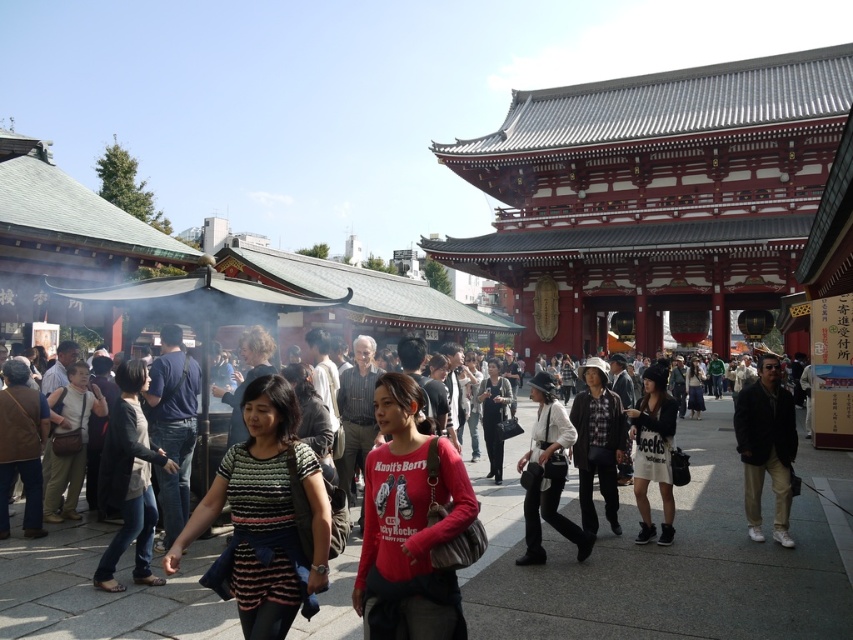
Question: Which of the following is the closest to the observer?

Choices:
 (A) matte red shirt at center
 (B) white cotton dress at center
 (C) dark gray fabric jacket at center

Answer: (A)

Question: Can you confirm if white matte jacket at center is wider than black matte jacket at center?

Choices:
 (A) no
 (B) yes

Answer: (B)

Question: Which object is closer to the camera taking this photo?

Choices:
 (A) white cotton dress at center
 (B) dark gray jacket at center

Answer: (B)

Question: Where is dark gray jacket at center located in relation to black matte jacket at center in the image?

Choices:
 (A) below
 (B) above

Answer: (B)

Question: Which point is farther to the camera?

Choices:
 (A) black matte jacket at center
 (B) white matte jacket at center
 (C) dark gray fabric jacket at center
 (D) striped cotton shirt at center

Answer: (A)

Question: Does white cotton dress at center have a lesser width compared to matte black dress at center?

Choices:
 (A) no
 (B) yes

Answer: (A)